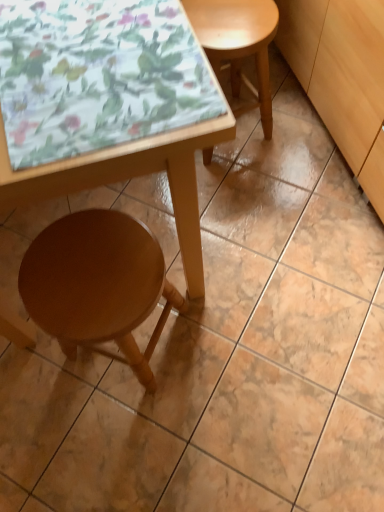
Measure the distance between point (145, 30) and camera.

The distance of point (145, 30) from camera is 27.95 inches.

Describe the element at coordinates (97, 284) in the screenshot. I see `wooden stool at lower left, the first stool viewed from the left` at that location.

The image size is (384, 512). What do you see at coordinates (342, 77) in the screenshot?
I see `light wood cabinet at lower right` at bounding box center [342, 77].

This screenshot has height=512, width=384. Find the location of `light brown wood stool at upper right, the first stool viewed from the top`. light brown wood stool at upper right, the first stool viewed from the top is located at coordinates (238, 46).

Find the location of `wooden table at lower left`. wooden table at lower left is located at coordinates (107, 104).

From the picture: How far apart are wooden table at lower left and wooden stool at lower left, acting as the 1th stool starting from the bottom?

wooden table at lower left is 9.89 inches away from wooden stool at lower left, acting as the 1th stool starting from the bottom.

Is wooden table at lower left not close to wooden stool at lower left, which ranks as the second stool in top-to-bottom order?

No, wooden table at lower left is not far from wooden stool at lower left, which ranks as the second stool in top-to-bottom order.

Is wooden table at lower left positioned beyond the bounds of wooden stool at lower left, acting as the 1th stool starting from the bottom?

wooden table at lower left lies outside wooden stool at lower left, acting as the 1th stool starting from the bottom,'s area.

Between wooden table at lower left and wooden stool at lower left, the 2th stool when ordered from right to left, which one is positioned in front?

wooden table at lower left is closer to the camera.

From the picture: How different are the orientations of wooden stool at lower left, which ranks as the second stool in top-to-bottom order, and light wood cabinet at lower right in degrees?

91.7 degrees.

Is wooden stool at lower left, the 2th stool when ordered from right to left, bigger or smaller than light wood cabinet at lower right?

Clearly, wooden stool at lower left, the 2th stool when ordered from right to left, is smaller in size than light wood cabinet at lower right.

Find the location of a particular element. cabinetry above the wooden stool at lower left, acting as the 1th stool starting from the bottom (from the image's perspective) is located at coordinates pyautogui.click(x=342, y=77).

Is light brown wood stool at upper right, placed as the 1th stool when sorted from right to left, positioned in front of wooden table at lower left?

No, it is behind wooden table at lower left.

Based on the photo, from a real-world perspective, between light brown wood stool at upper right, arranged as the second stool when ordered from the bottom, and wooden table at lower left, who is vertically higher?

wooden table at lower left is physically above.

Between point (242, 73) and point (6, 148), which one is positioned in front?

Positioned in front is point (6, 148).

Is wooden table at lower left completely or partially inside light brown wood stool at upper right, arranged as the second stool when ordered from the bottom?

No, wooden table at lower left is not surrounded by light brown wood stool at upper right, arranged as the second stool when ordered from the bottom.

Does wooden table at lower left have a greater width compared to light brown wood stool at upper right, arranged as the second stool when ordered from the bottom?

Yes, wooden table at lower left is wider than light brown wood stool at upper right, arranged as the second stool when ordered from the bottom.

In the scene shown: Does wooden table at lower left have a larger size compared to light brown wood stool at upper right, placed as the 1th stool when sorted from right to left?

Correct, wooden table at lower left is larger in size than light brown wood stool at upper right, placed as the 1th stool when sorted from right to left.

From a real-world perspective, is wooden table at lower left beneath light brown wood stool at upper right, the first stool viewed from the top?

No, from a real-world perspective, wooden table at lower left is not under light brown wood stool at upper right, the first stool viewed from the top.

Is wooden table at lower left closer to camera compared to light brown wood stool at upper right, the first stool viewed from the top?

Yes, wooden table at lower left is closer to the viewer.

Is light brown wood stool at upper right, which is the second stool from left to right, at the back of light wood cabinet at lower right?

light wood cabinet at lower right does not have its back to light brown wood stool at upper right, which is the second stool from left to right.

How distant is light wood cabinet at lower right from light brown wood stool at upper right, arranged as the second stool when ordered from the bottom?

light wood cabinet at lower right and light brown wood stool at upper right, arranged as the second stool when ordered from the bottom, are 9.95 inches apart from each other.

Is light wood cabinet at lower right directly adjacent to light brown wood stool at upper right, which is the second stool from left to right?

They are not placed beside each other.

Is light wood cabinet at lower right wider than light brown wood stool at upper right, arranged as the second stool when ordered from the bottom?

Yes, light wood cabinet at lower right is wider than light brown wood stool at upper right, arranged as the second stool when ordered from the bottom.

Does wooden table at lower left have a lesser height compared to light wood cabinet at lower right?

In fact, wooden table at lower left may be taller than light wood cabinet at lower right.

Is wooden table at lower left surrounding light wood cabinet at lower right?

No, wooden table at lower left does not contain light wood cabinet at lower right.

From the image's perspective, between wooden table at lower left and light wood cabinet at lower right, which one is located above?

light wood cabinet at lower right, from the image's perspective.

Could you tell me if wooden table at lower left is facing light wood cabinet at lower right?

No, wooden table at lower left is not aimed at light wood cabinet at lower right.

Is point (318, 15) closer or farther from the camera than point (191, 261)?

Point (318, 15) is farther from the camera than point (191, 261).

Which is behind, light wood cabinet at lower right or wooden table at lower left?

light wood cabinet at lower right is behind.

Based on their positions, is light wood cabinet at lower right located to the left or right of wooden table at lower left?

In the image, light wood cabinet at lower right appears on the right side of wooden table at lower left.

Who is smaller, light wood cabinet at lower right or wooden table at lower left?

Smaller between the two is light wood cabinet at lower right.

Where is `table in front of the wooden stool at lower left, the 2th stool when ordered from right to left`? table in front of the wooden stool at lower left, the 2th stool when ordered from right to left is located at coordinates (107, 104).

You are a GUI agent. You are given a task and a screenshot of the screen. Output one action in this format:
    pyautogui.click(x=<x>, y=<y>)
    Task: Click on the cabinetry located on the right of wooden stool at lower left, the first stool viewed from the left
    The height and width of the screenshot is (512, 384).
    Given the screenshot: What is the action you would take?
    pyautogui.click(x=342, y=77)

When comparing their distances from wooden stool at lower left, which ranks as the second stool in top-to-bottom order, does wooden table at lower left or light brown wood stool at upper right, placed as the 1th stool when sorted from right to left, seem closer?

The object closer to wooden stool at lower left, which ranks as the second stool in top-to-bottom order, is wooden table at lower left.

When comparing their distances from wooden table at lower left, does wooden stool at lower left, the 2th stool when ordered from right to left, or light wood cabinet at lower right seem further?

The object further to wooden table at lower left is light wood cabinet at lower right.

From the image, which object appears to be nearer to light wood cabinet at lower right, wooden stool at lower left, the first stool viewed from the left, or wooden table at lower left?

Among the two, wooden table at lower left is located nearer to light wood cabinet at lower right.

Considering their positions, is light brown wood stool at upper right, placed as the 1th stool when sorted from right to left, positioned further to light wood cabinet at lower right than wooden table at lower left?

wooden table at lower left lies further to light wood cabinet at lower right than the other object.

From the picture: Which object lies nearer to the anchor point wooden stool at lower left, the first stool viewed from the left, light wood cabinet at lower right or wooden table at lower left?

wooden table at lower left is positioned closer to the anchor wooden stool at lower left, the first stool viewed from the left.

Looking at the image, which one is located closer to wooden table at lower left, light brown wood stool at upper right, placed as the 1th stool when sorted from right to left, or wooden stool at lower left, the 2th stool when ordered from right to left?

Among the two, wooden stool at lower left, the 2th stool when ordered from right to left, is located nearer to wooden table at lower left.

Looking at the image, which one is located further to light wood cabinet at lower right, wooden stool at lower left, the first stool viewed from the left, or light brown wood stool at upper right, placed as the 1th stool when sorted from right to left?

wooden stool at lower left, the first stool viewed from the left, lies further to light wood cabinet at lower right than the other object.

Looking at this image, estimate the real-world distances between objects in this image. Which object is closer to wooden table at lower left, light wood cabinet at lower right or wooden stool at lower left, which ranks as the second stool in top-to-bottom order?

Among the two, wooden stool at lower left, which ranks as the second stool in top-to-bottom order, is located nearer to wooden table at lower left.

At what (x,y) coordinates should I click in order to perform the action: click on stool located between wooden stool at lower left, acting as the 1th stool starting from the bottom, and light wood cabinet at lower right in the left-right direction. Please return your answer as a coordinate pair (x, y). The height and width of the screenshot is (512, 384). Looking at the image, I should click on (238, 46).

At what (x,y) coordinates should I click in order to perform the action: click on table between light brown wood stool at upper right, the first stool viewed from the top, and wooden stool at lower left, acting as the 1th stool starting from the bottom, from top to bottom. Please return your answer as a coordinate pair (x, y). This screenshot has width=384, height=512. Looking at the image, I should click on (107, 104).